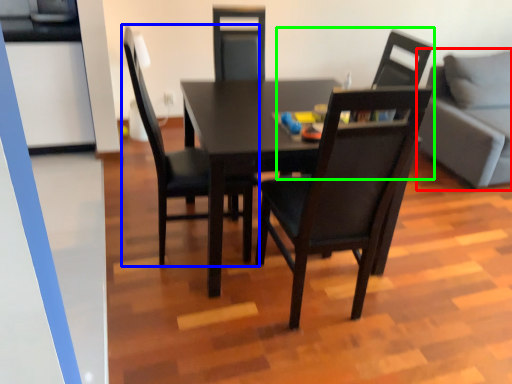
Question: Which object is the farthest from studio couch (highlighted by a red box)? Choose among these: chair (highlighted by a blue box) or chair (highlighted by a green box).

Choices:
 (A) chair
 (B) chair

Answer: (A)